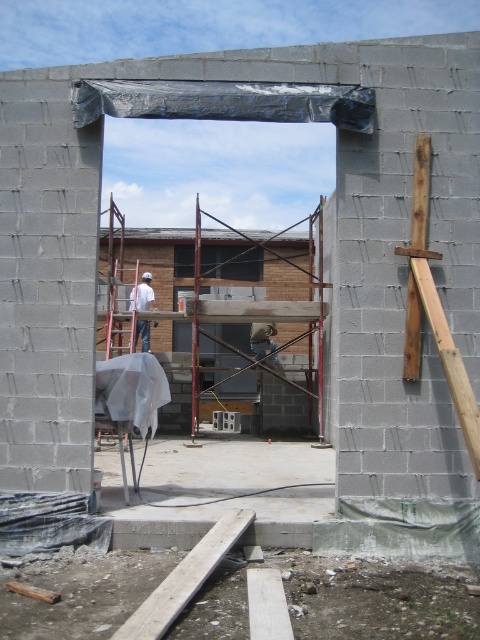
You are a safety inspector visiting the construction site shown in the image. You notice the gray wood beam at lower center and the light brown leather helmet at center. Which object takes up more space in the scene?

The light brown leather helmet at center takes up more space than the gray wood beam at lower center.

You are a construction worker standing at the entrance of the building. You need to place a new wooden support beam exactly at the same position as the gray wood beam at lower center. According to the coordinates provided, where should you position the new beam?

The gray wood beam at lower center should be placed at the 2D coordinates point (184, 579).

You are a safety inspector at the construction site depicted in the image. You notice the white matte construction worker at left and the light brown leather helmet at center. Which object is positioned further to the left?

The white matte construction worker at left is positioned further to the left than the light brown leather helmet at center.